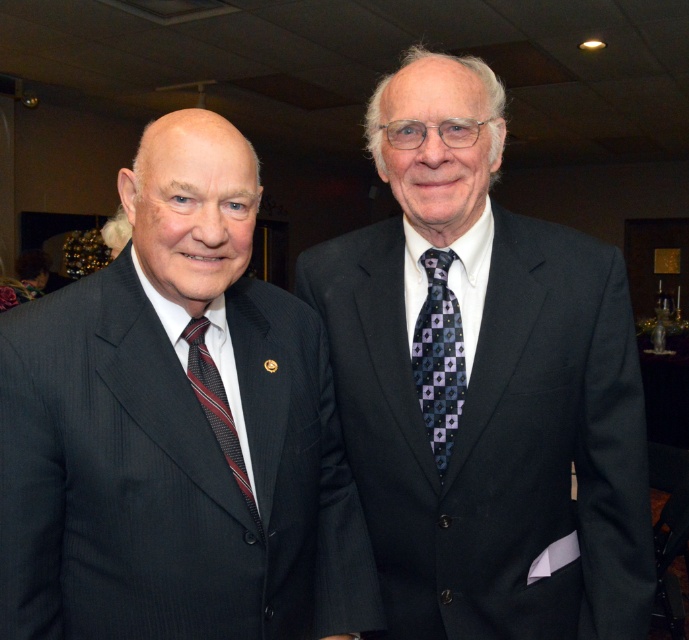
Question: Which of the following is the closest to the observer?

Choices:
 (A) dark blue textured tie at center
 (B) dark gray suit at right
 (C) striped silk tie at left
 (D) matte black suit at left

Answer: (D)

Question: Is dark gray suit at right to the right of dark blue textured tie at center from the viewer's perspective?

Choices:
 (A) no
 (B) yes

Answer: (B)

Question: Can you confirm if matte black suit at left is positioned to the right of dark blue textured tie at center?

Choices:
 (A) yes
 (B) no

Answer: (B)

Question: Which of the following is the closest to the observer?

Choices:
 (A) (451, 380)
 (B) (107, 480)
 (C) (508, 368)
 (D) (203, 374)

Answer: (B)

Question: Which point is farther to the camera?

Choices:
 (A) matte black suit at left
 (B) dark gray suit at right

Answer: (B)

Question: Does dark gray suit at right appear over dark blue textured tie at center?

Choices:
 (A) no
 (B) yes

Answer: (B)